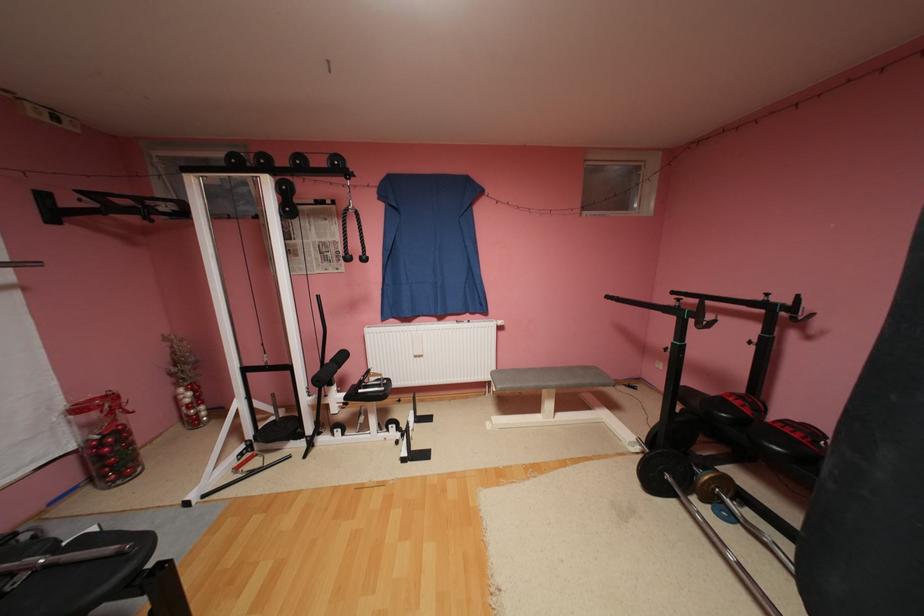
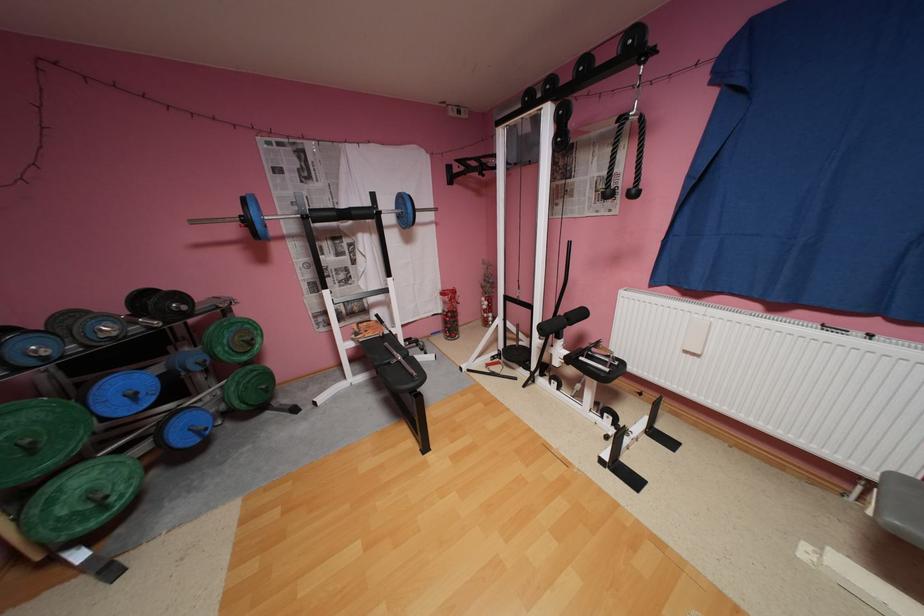
Where in the second image is the point corresponding to point (335, 360) from the first image?

(570, 312)